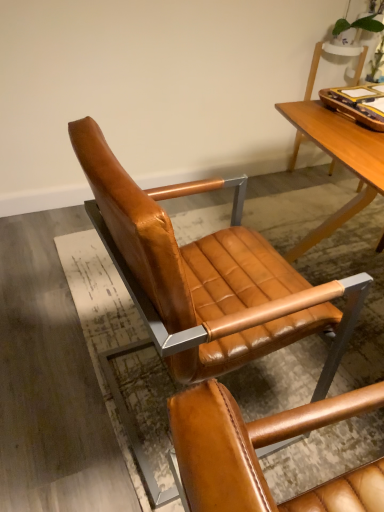
At what (x,y) coordinates should I click in order to perform the action: click on free space to the left of cognac leather chair at center. Please return your answer as a coordinate pair (x, y). This screenshot has height=512, width=384. Looking at the image, I should click on click(x=57, y=370).